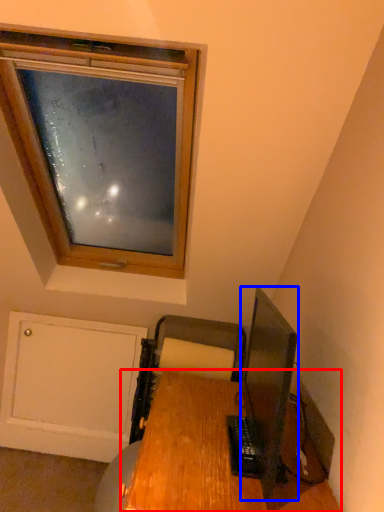
Question: Which object appears farthest to the camera in this image, desk (highlighted by a red box) or television (highlighted by a blue box)?

Choices:
 (A) desk
 (B) television

Answer: (B)